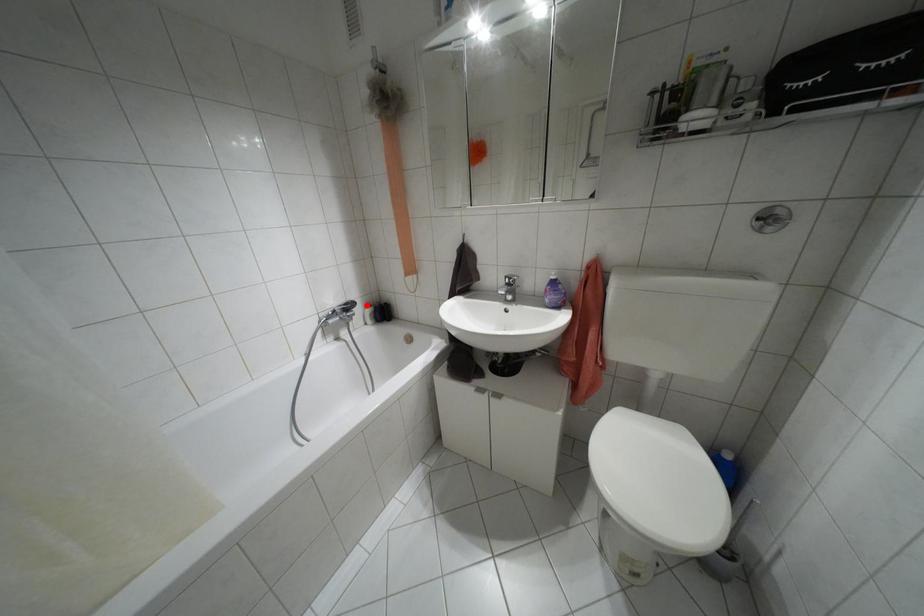
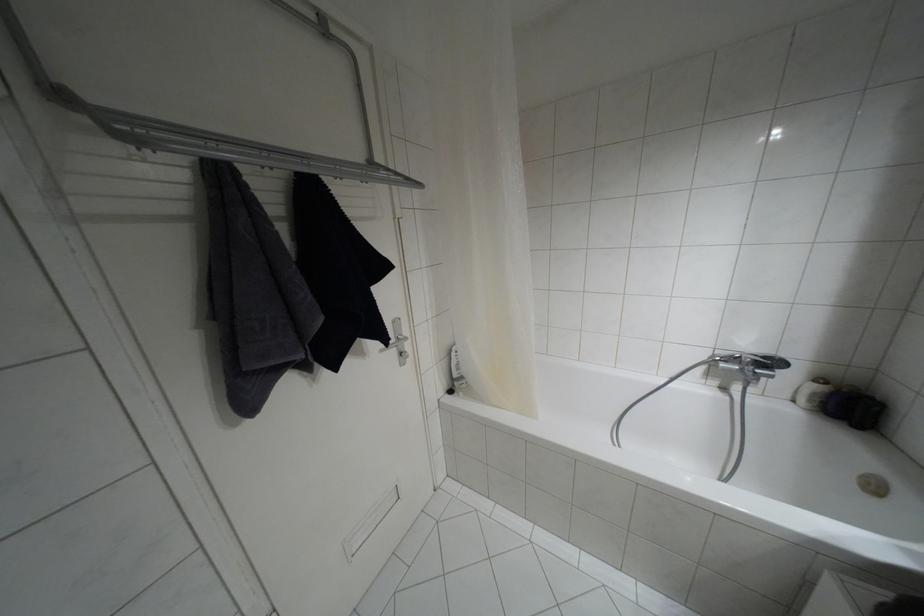
The point at the highlighted location is marked in the first image. Where is the corresponding point in the second image?

(820, 379)